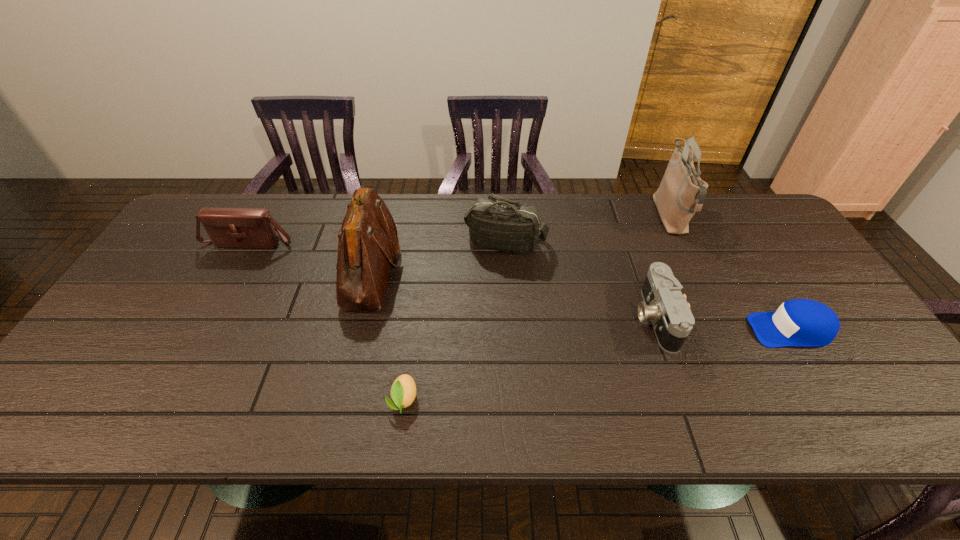
The height and width of the screenshot is (540, 960). I want to click on the shortest object, so point(403,391).

Find the location of a particular element. Image resolution: width=960 pixels, height=540 pixels. lemon is located at coordinates (403, 391).

Locate an element on the screen. vacant region located 0.250m on the front-facing side of the second object from right to left is located at coordinates (577, 217).

Locate an element on the screen. free spot located 0.330m on the front-facing side of the second object from right to left is located at coordinates coord(552,217).

Find the location of `vacant region located on the front-facing side of the second object from right to left`. vacant region located on the front-facing side of the second object from right to left is located at coordinates (533, 217).

The height and width of the screenshot is (540, 960). I want to click on free spot located 0.330m on the left of the sixth object from right to left, so click(225, 269).

I want to click on vacant area located 0.400m at the front padded panel of the fifth shortest object, so coord(514,380).

Where is `free spot located 0.260m on the front flap of the shortest shoulder bag`? free spot located 0.260m on the front flap of the shortest shoulder bag is located at coordinates (207, 321).

Where is `vacant point located on the lens of the fifth tallest object`? vacant point located on the lens of the fifth tallest object is located at coordinates (546, 318).

Locate an element on the screen. The image size is (960, 540). vacant space situated 0.160m on the lens of the fifth tallest object is located at coordinates (573, 318).